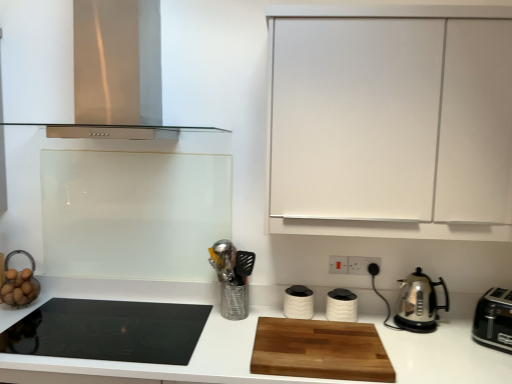
I want to click on vacant region above black glass cooktop at lower left (from a real-world perspective), so click(126, 324).